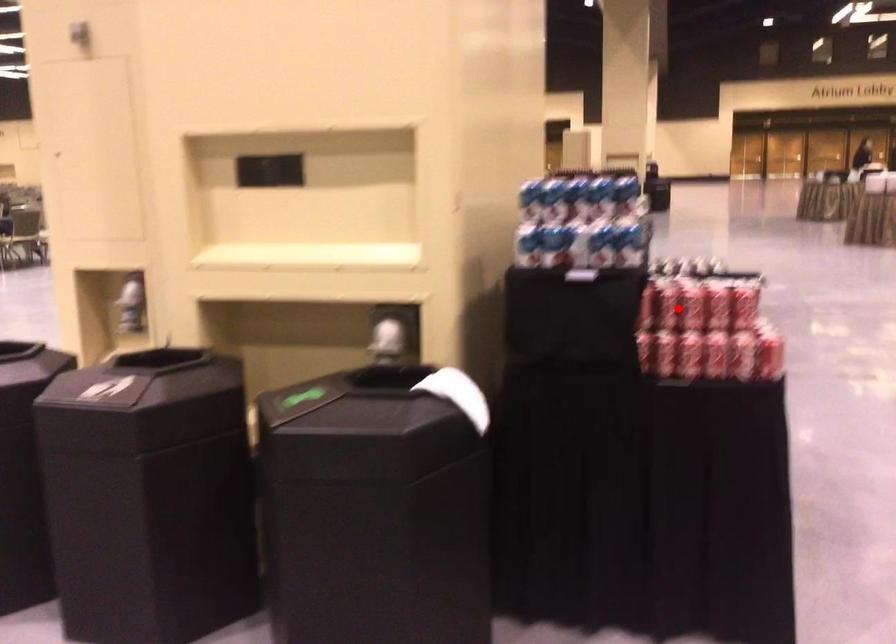
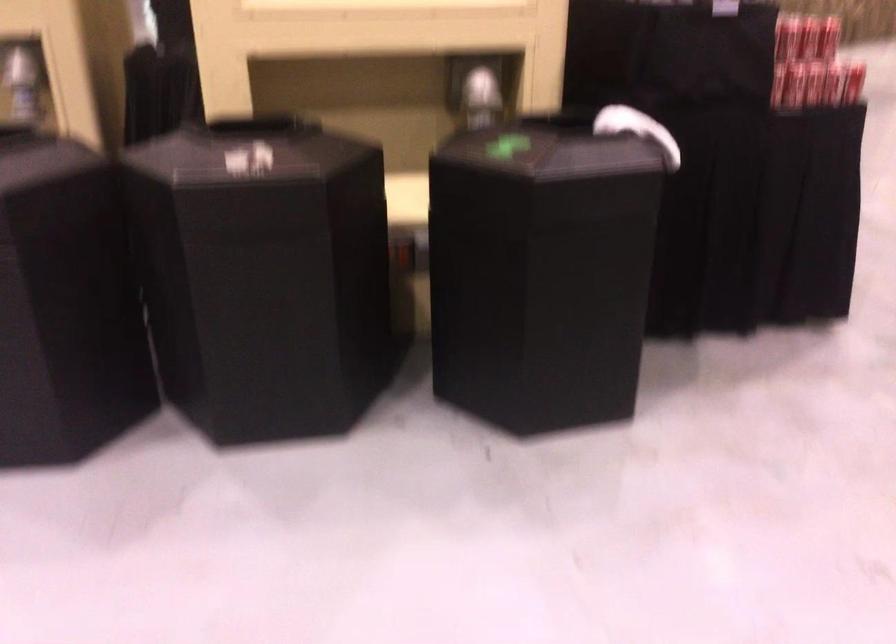
Locate, in the second image, the point that corresponds to the highlighted location in the first image.

(787, 37)